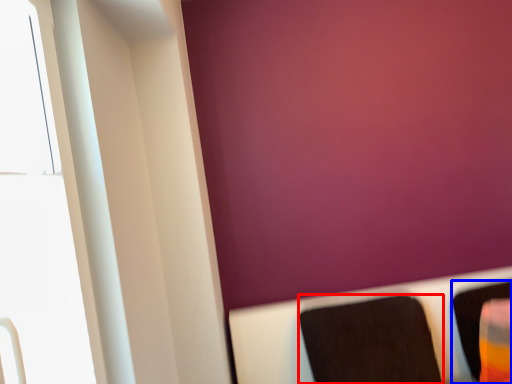
Question: Which object is further to the camera taking this photo, furniture (highlighted by a red box) or furniture (highlighted by a blue box)?

Choices:
 (A) furniture
 (B) furniture

Answer: (B)